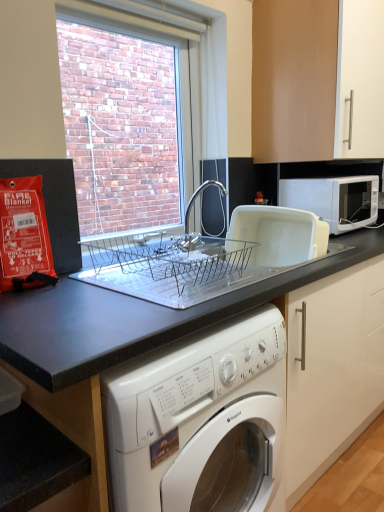
Question: Is white plastic dish drainer at upper right bigger than black granite countertop at center?

Choices:
 (A) yes
 (B) no

Answer: (B)

Question: Does white plastic dish drainer at upper right have a lesser width compared to black granite countertop at center?

Choices:
 (A) no
 (B) yes

Answer: (B)

Question: Considering the relative positions of white plastic dish drainer at upper right and black granite countertop at center in the image provided, is white plastic dish drainer at upper right behind black granite countertop at center?

Choices:
 (A) yes
 (B) no

Answer: (A)

Question: From the image's perspective, would you say white plastic dish drainer at upper right is shown under black granite countertop at center?

Choices:
 (A) no
 (B) yes

Answer: (A)

Question: Is white plastic dish drainer at upper right to the right of black granite countertop at center from the viewer's perspective?

Choices:
 (A) yes
 (B) no

Answer: (A)

Question: In terms of height, does matte wood cabinet at upper right look taller or shorter compared to white plastic dish drainer at upper right?

Choices:
 (A) short
 (B) tall

Answer: (B)

Question: From a real-world perspective, relative to white plastic dish drainer at upper right, is matte wood cabinet at upper right vertically above or below?

Choices:
 (A) below
 (B) above

Answer: (B)

Question: Looking at the image, does matte wood cabinet at upper right seem bigger or smaller compared to white plastic dish drainer at upper right?

Choices:
 (A) small
 (B) big

Answer: (B)

Question: Is matte wood cabinet at upper right situated inside white plastic dish drainer at upper right or outside?

Choices:
 (A) outside
 (B) inside

Answer: (A)

Question: Relative to white matte microwave at upper right, is matte wood cabinet at upper right in front or behind?

Choices:
 (A) behind
 (B) front

Answer: (B)

Question: Based on their positions, is matte wood cabinet at upper right located to the left or right of white matte microwave at upper right?

Choices:
 (A) left
 (B) right

Answer: (A)

Question: In terms of height, does matte wood cabinet at upper right look taller or shorter compared to white matte microwave at upper right?

Choices:
 (A) short
 (B) tall

Answer: (B)

Question: From the image's perspective, relative to white matte microwave at upper right, is matte wood cabinet at upper right above or below?

Choices:
 (A) above
 (B) below

Answer: (A)

Question: From a real-world perspective, is white plastic dish drainer at upper right above or below black granite countertop at center?

Choices:
 (A) above
 (B) below

Answer: (A)

Question: Is white plastic dish drainer at upper right bigger or smaller than black granite countertop at center?

Choices:
 (A) small
 (B) big

Answer: (A)